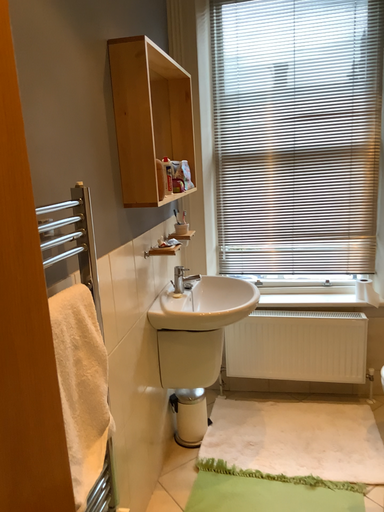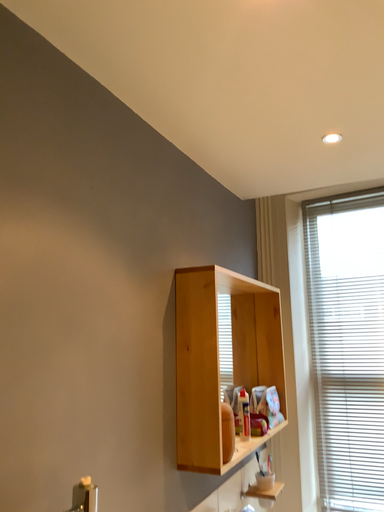
Question: How did the camera likely rotate when shooting the video?

Choices:
 (A) rotated left
 (B) rotated right

Answer: (A)